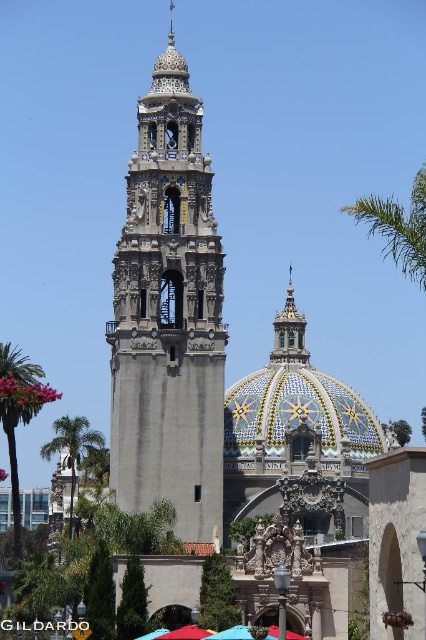
Question: Considering the real-world distances, which object is farthest from the matte gray stone bell tower at center?

Choices:
 (A) multicolored mosaic dome at center
 (B) green leafy palm tree at upper right
 (C) green leafy palm tree at left
 (D) green leafy palm tree at lower left

Answer: (A)

Question: Can you confirm if matte gray stone bell tower at center is positioned above green leafy palm tree at left?

Choices:
 (A) yes
 (B) no

Answer: (A)

Question: Which of the following is the closest to the observer?

Choices:
 (A) multicolored mosaic dome at center
 (B) green leafy palm tree at left

Answer: (B)

Question: Which object is the closest to the multicolored mosaic dome at center?

Choices:
 (A) green leafy palm tree at upper right
 (B) green leafy palm tree at lower left
 (C) matte gray stone bell tower at center

Answer: (A)

Question: Considering the relative positions of matte gray stone bell tower at center and green leafy palm tree at left in the image provided, where is matte gray stone bell tower at center located with respect to green leafy palm tree at left?

Choices:
 (A) left
 (B) right

Answer: (B)

Question: Does matte gray stone bell tower at center have a larger size compared to green leafy palm tree at left?

Choices:
 (A) yes
 (B) no

Answer: (A)